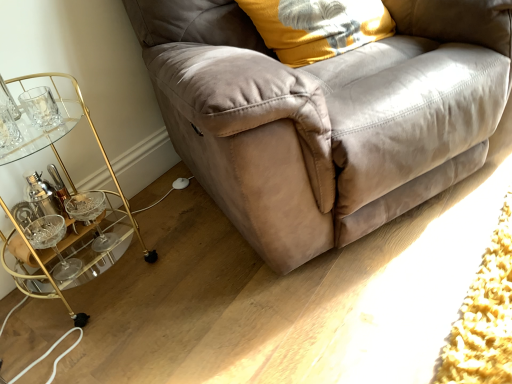
Question: Looking at the image, does suede couch at center seem bigger or smaller compared to gold metallic bar cart at left?

Choices:
 (A) small
 (B) big

Answer: (B)

Question: Is suede couch at center taller or shorter than gold metallic bar cart at left?

Choices:
 (A) short
 (B) tall

Answer: (B)

Question: Which is nearer to the gold metallic bar cart at left?

Choices:
 (A) soft yellow fabric pillow at upper right
 (B) suede couch at center

Answer: (B)

Question: Considering the real-world distances, which object is farthest from the gold metallic bar cart at left?

Choices:
 (A) soft yellow fabric pillow at upper right
 (B) suede couch at center

Answer: (A)